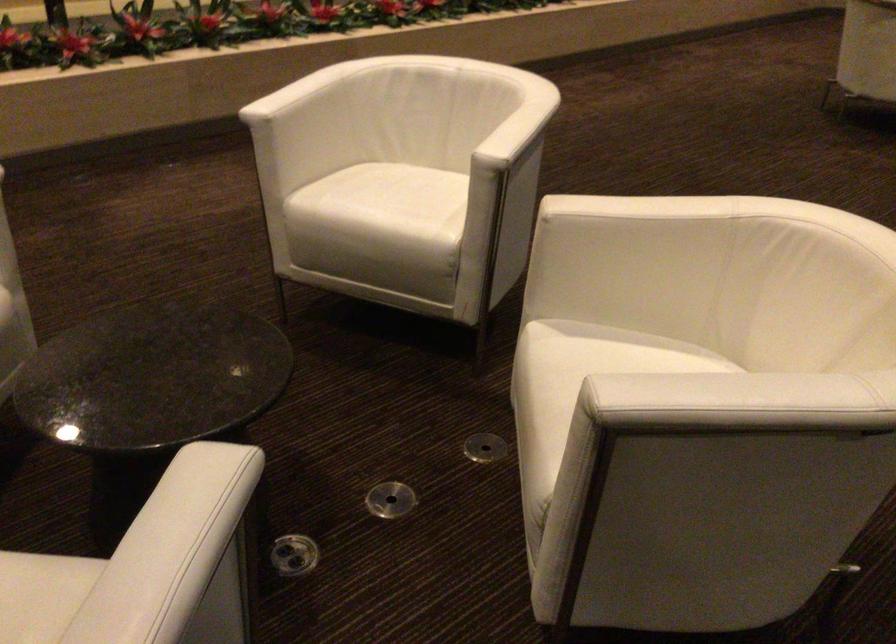
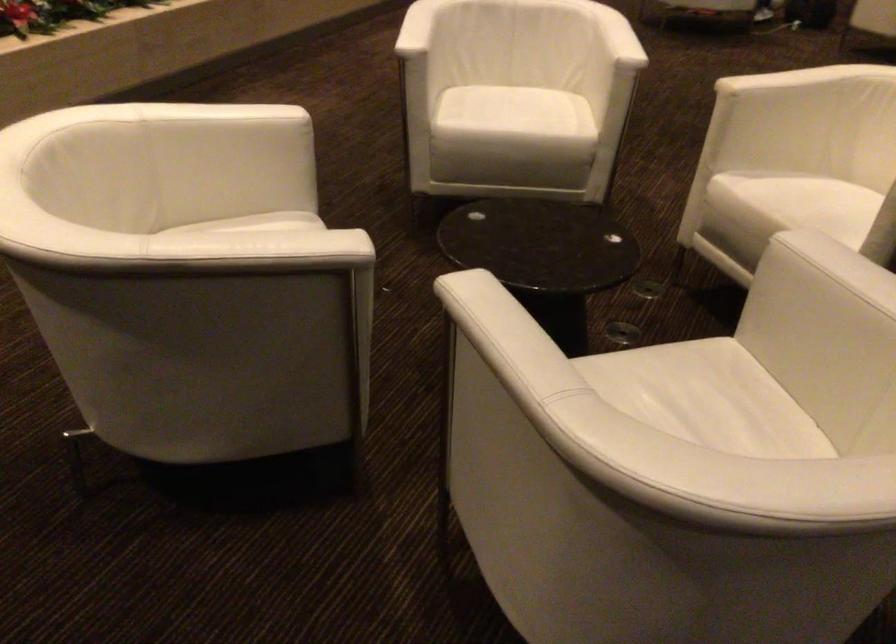
Where in the second image is the point corresponding to (x=291, y=93) from the first image?

(417, 28)